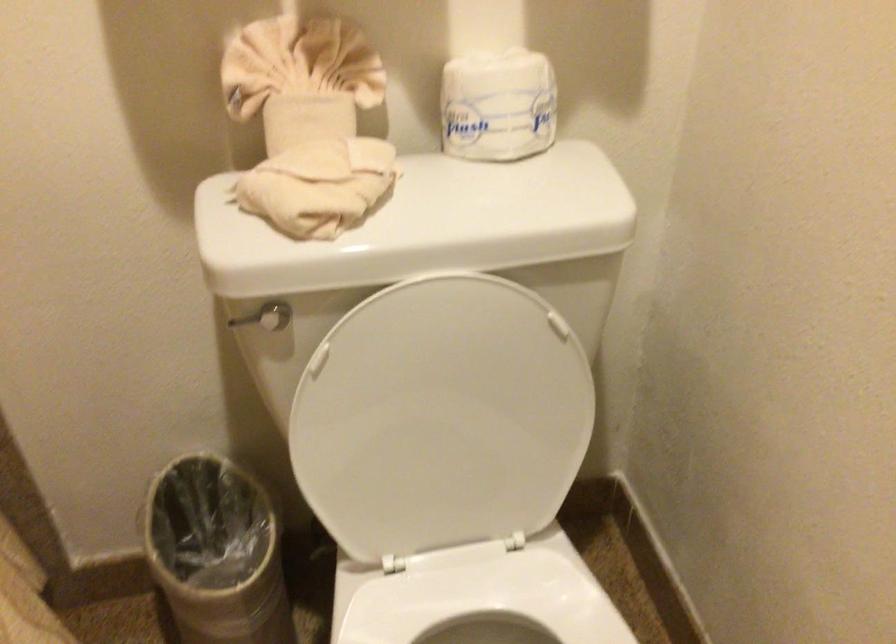
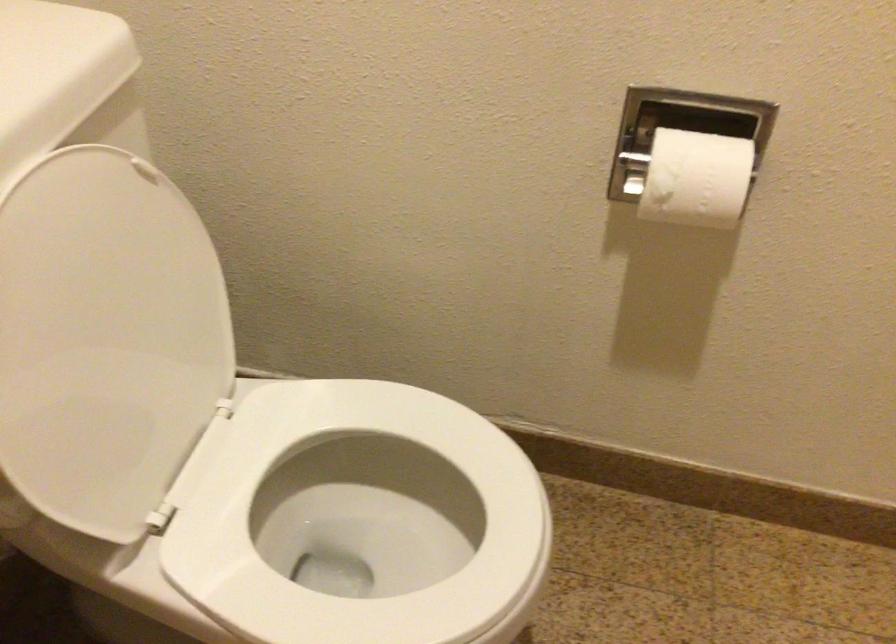
Where in the second image is the point corresponding to point (433, 415) from the first image?

(105, 339)